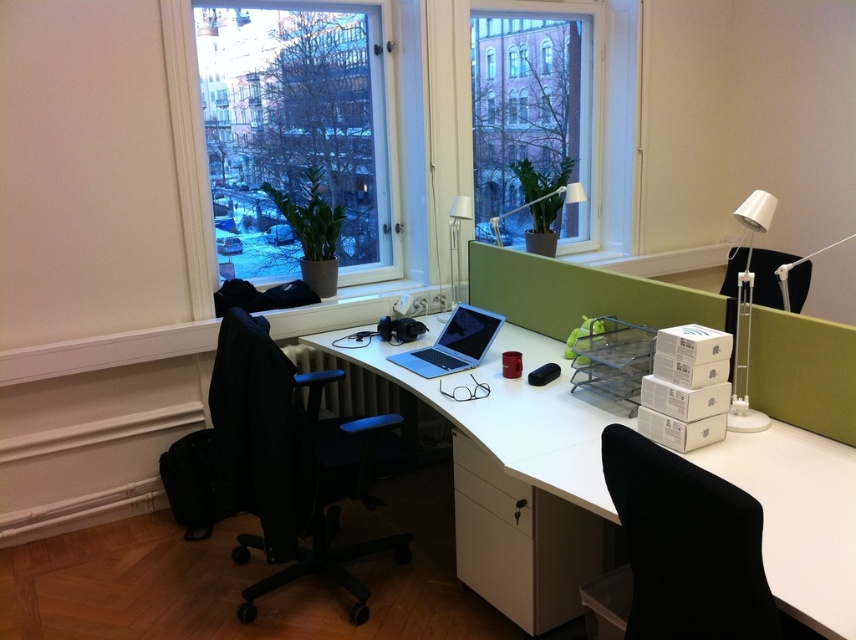
Based on the photo, is white glossy computer desk at center bigger than clear glass window at upper center?

Yes, white glossy computer desk at center is bigger than clear glass window at upper center.

Can you confirm if white glossy computer desk at center is positioned to the left of clear glass window at upper center?

Indeed, white glossy computer desk at center is positioned on the left side of clear glass window at upper center.

Who is more forward, (520, 474) or (501, 102)?

Point (520, 474)

The image size is (856, 640). Find the location of `white glossy computer desk at center`. white glossy computer desk at center is located at coordinates (510, 412).

This screenshot has height=640, width=856. Describe the element at coordinates (687, 545) in the screenshot. I see `black fabric swivel chair at lower right` at that location.

Does black fabric swivel chair at lower right appear over clear glass window at center?

No, black fabric swivel chair at lower right is not above clear glass window at center.

Is point (635, 592) closer to viewer compared to point (494, 65)?

Yes, point (635, 592) is in front of point (494, 65).

Find the location of a particular element. The height and width of the screenshot is (640, 856). black fabric swivel chair at lower right is located at coordinates (687, 545).

Is clear glass window at upper center positioned behind sleek silver laptop at center?

Yes, it is.

Does clear glass window at upper center appear on the left side of sleek silver laptop at center?

Incorrect, clear glass window at upper center is not on the left side of sleek silver laptop at center.

I want to click on clear glass window at upper center, so pyautogui.click(x=528, y=104).